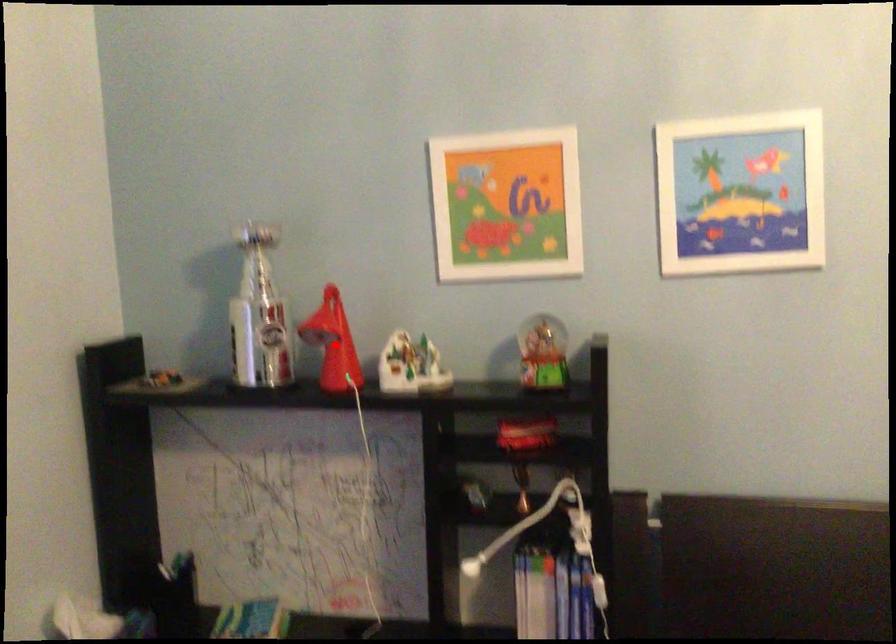
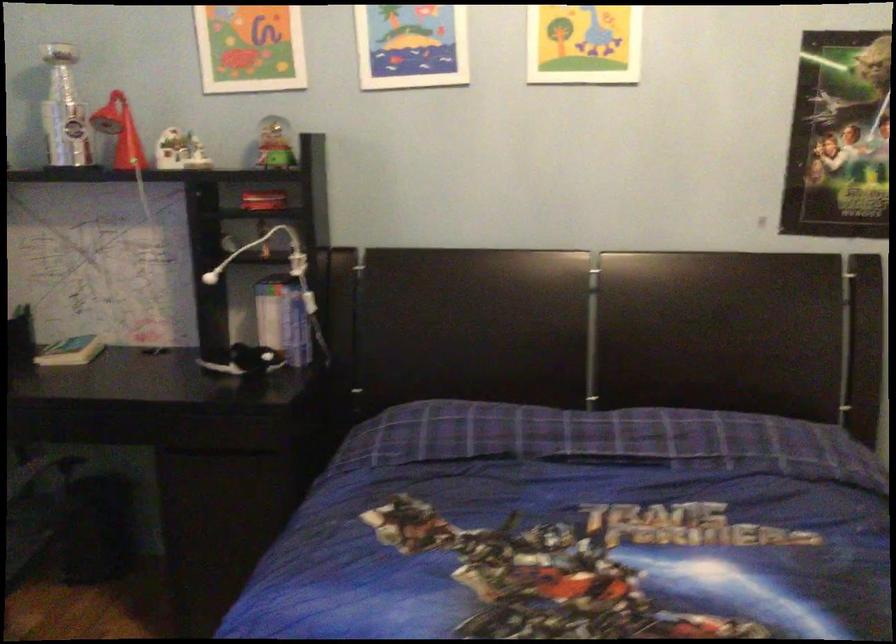
Question: A red point is marked in image1. In image2, is the corresponding 3D point closer to the camera or farther? Reply with the corresponding letter.

Choices:
 (A) The corresponding 3D point is closer.
 (B) The corresponding 3D point is farther.

Answer: (B)